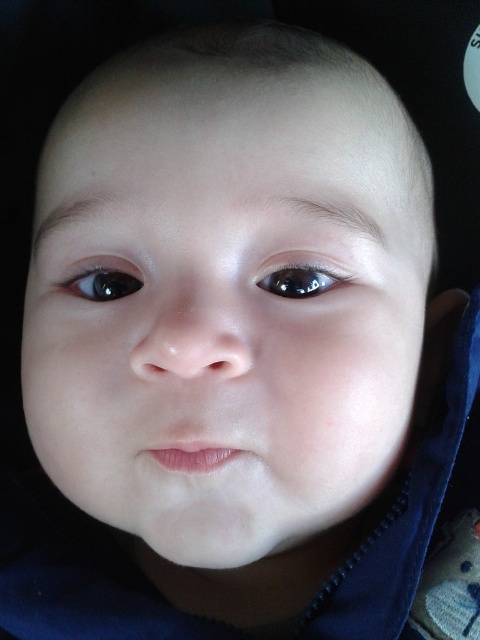
Does black glossy eye at upper left lie in front of glossy black eye at upper center?

No, it is not.

Which is behind, point (75, 276) or point (296, 269)?

The point (75, 276) is more distant.

Find the location of a particular element. black glossy eye at upper left is located at coordinates (105, 280).